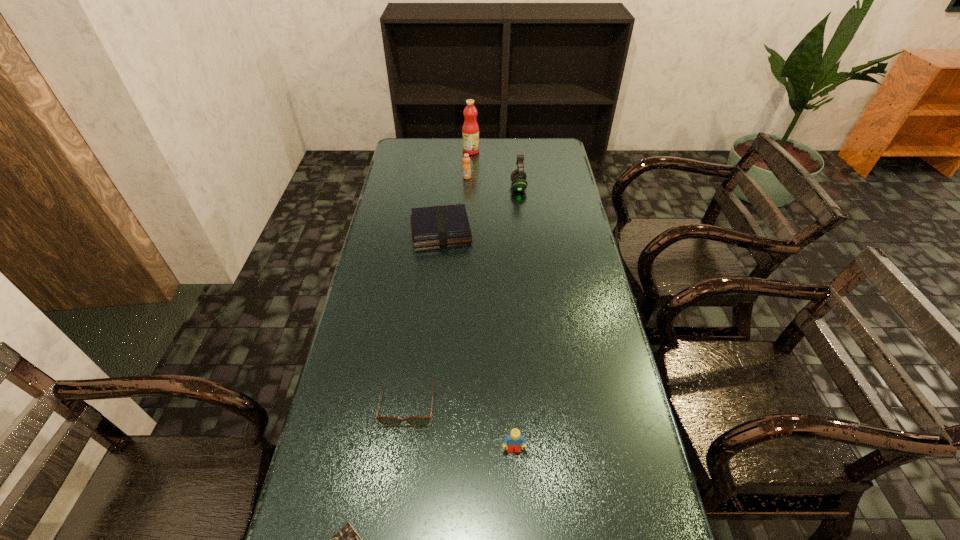
Image resolution: width=960 pixels, height=540 pixels. Find the location of `the third nearest object`. the third nearest object is located at coordinates (419, 421).

I want to click on spectacles, so click(x=419, y=421).

Identify the location of free space located on the front label of the farthest object. This screenshot has width=960, height=540. (554, 151).

Locate an element on the screen. vacant space positioned on the ear cups of the third farthest object is located at coordinates (454, 187).

Image resolution: width=960 pixels, height=540 pixels. In order to click on vacant space situated 0.240m on the ear cups of the third farthest object in this screenshot , I will do `click(452, 187)`.

The image size is (960, 540). I want to click on free spot located 0.380m on the ear cups of the third farthest object, so click(x=418, y=187).

What are the coordinates of `free space located on the front label of the third tallest object` in the screenshot? It's located at coord(467,194).

Locate an element on the screen. This screenshot has height=540, width=960. vacant area situated on the face of the fourth tallest object is located at coordinates [518, 531].

At what (x,y) coordinates should I click in order to perform the action: click on blank space located 0.400m on the front of the fourth farthest object. Please return your answer as a coordinate pair (x, y). Looking at the image, I should click on 430,341.

Find the location of a particular element. This screenshot has width=960, height=540. free space located at the front view of the spectacles is located at coordinates (400, 469).